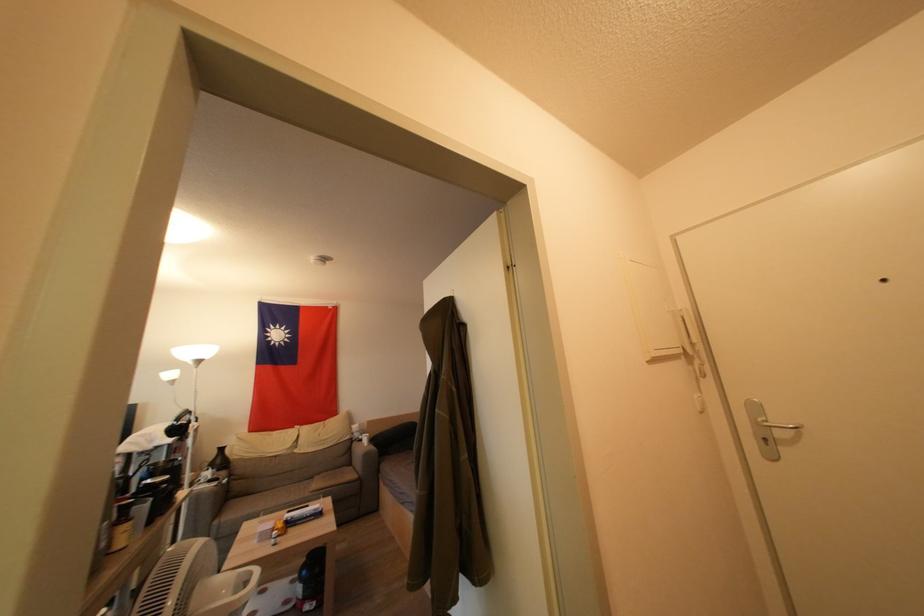
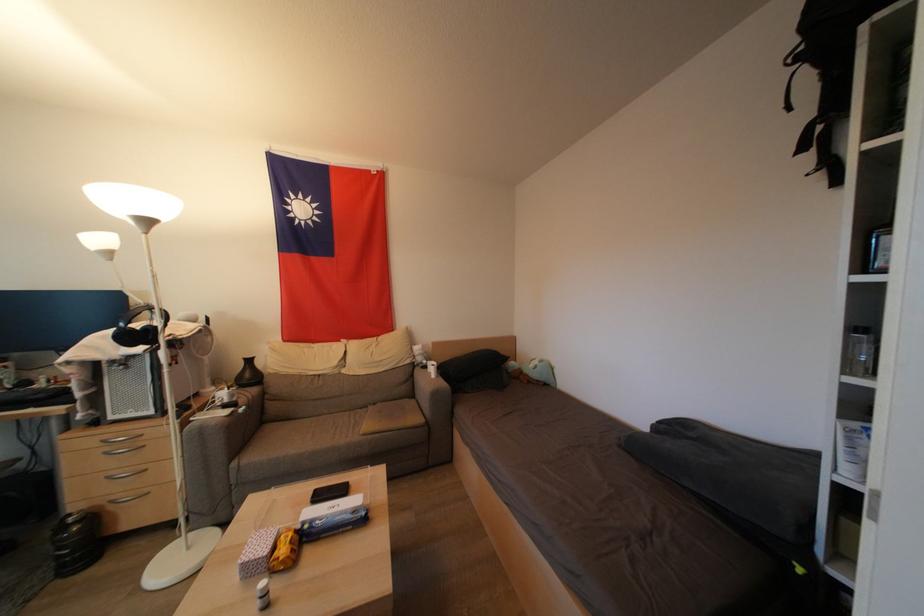
In the second image, find the point that corresponds to point 176,379 in the first image.

(104, 244)